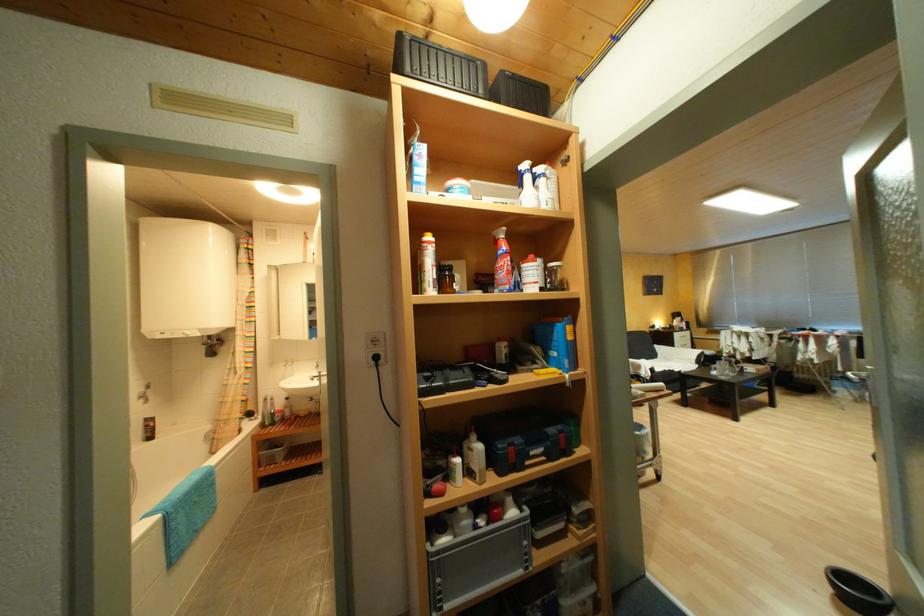
Where is `red spray bottle trigger`? The height and width of the screenshot is (616, 924). red spray bottle trigger is located at coordinates (494, 512).